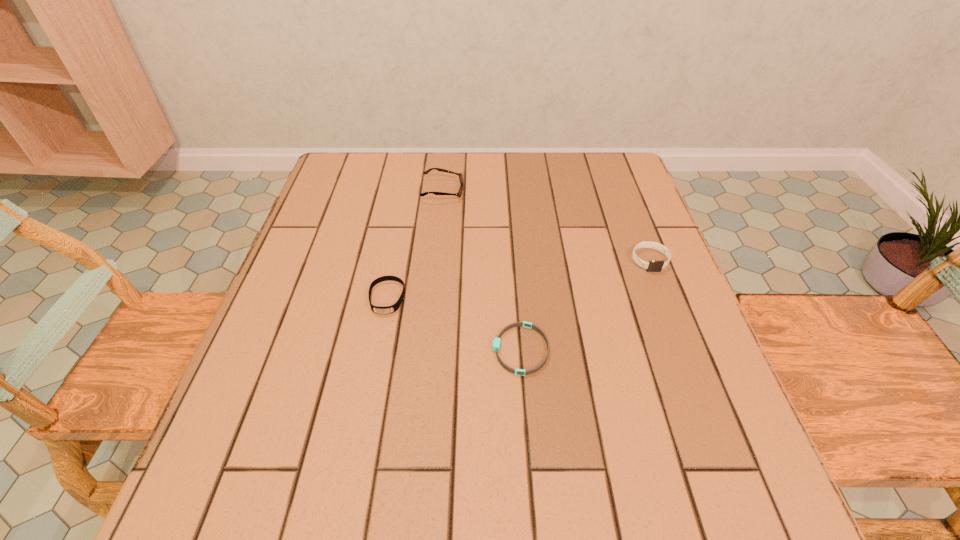
The height and width of the screenshot is (540, 960). I want to click on free space between the sunglasses and the second shortest wristband, so click(415, 244).

Identify which object is the closest to the shortest wristband. Please provide its 2D coordinates. Your answer should be formatted as a tuple, i.e. [(x, y)], where the tuple contains the x and y coordinates of a point satisfying the conditions above.

[(393, 308)]

Locate which object is the closest to the shortest wristband. Please provide its 2D coordinates. Your answer should be formatted as a tuple, i.e. [(x, y)], where the tuple contains the x and y coordinates of a point satisfying the conditions above.

[(393, 308)]

Identify which wristband is the second closest to the rightmost wristband. Please provide its 2D coordinates. Your answer should be formatted as a tuple, i.e. [(x, y)], where the tuple contains the x and y coordinates of a point satisfying the conditions above.

[(393, 308)]

Select which wristband is the second closest to the third tallest object. Please provide its 2D coordinates. Your answer should be formatted as a tuple, i.e. [(x, y)], where the tuple contains the x and y coordinates of a point satisfying the conditions above.

[(653, 266)]

Find the location of a particular element. The height and width of the screenshot is (540, 960). free space that satisfies the following two spatial constraints: 1. on the outer surface of the third shortest object; 2. on the buckle of the shortest wristband is located at coordinates (684, 349).

Identify the location of free space that satisfies the following two spatial constraints: 1. on the outer surface of the rightmost object; 2. on the buckle of the shortest wristband. The width and height of the screenshot is (960, 540). (684, 349).